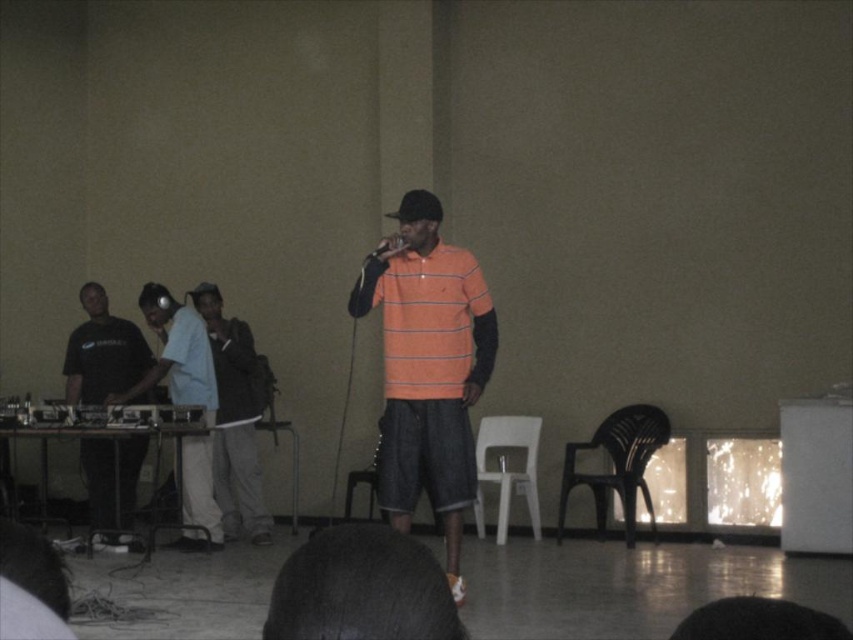
Question: Does orange striped polo shirt at center have a larger size compared to black plastic chair at lower right?

Choices:
 (A) yes
 (B) no

Answer: (A)

Question: Estimate the real-world distances between objects in this image. Which object is closer to the black matte dj controller at left?

Choices:
 (A) white plastic chair at center
 (B) plastic chair at center
 (C) light blue denim jacket at center

Answer: (C)

Question: Does white plastic chair at center appear over black matte microphone at center?

Choices:
 (A) no
 (B) yes

Answer: (A)

Question: Based on their relative distances, which object is nearer to the white plastic chair at center?

Choices:
 (A) light blue denim jacket at center
 (B) black matte dj controller at left

Answer: (A)

Question: Does light blue denim jacket at center appear over white plastic chair at center?

Choices:
 (A) yes
 (B) no

Answer: (A)

Question: Which of these objects is positioned closest to the light blue denim jacket at center?

Choices:
 (A) black matte dj controller at left
 (B) white plastic chair at center
 (C) black plastic chair at lower right
 (D) black matte microphone at center

Answer: (A)